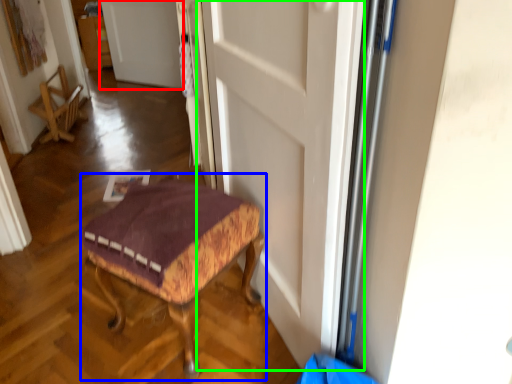
Question: Considering the real-world distances, which object is farthest from door (highlighted by a red box)? furniture (highlighted by a blue box) or door (highlighted by a green box)?

Choices:
 (A) furniture
 (B) door

Answer: (A)